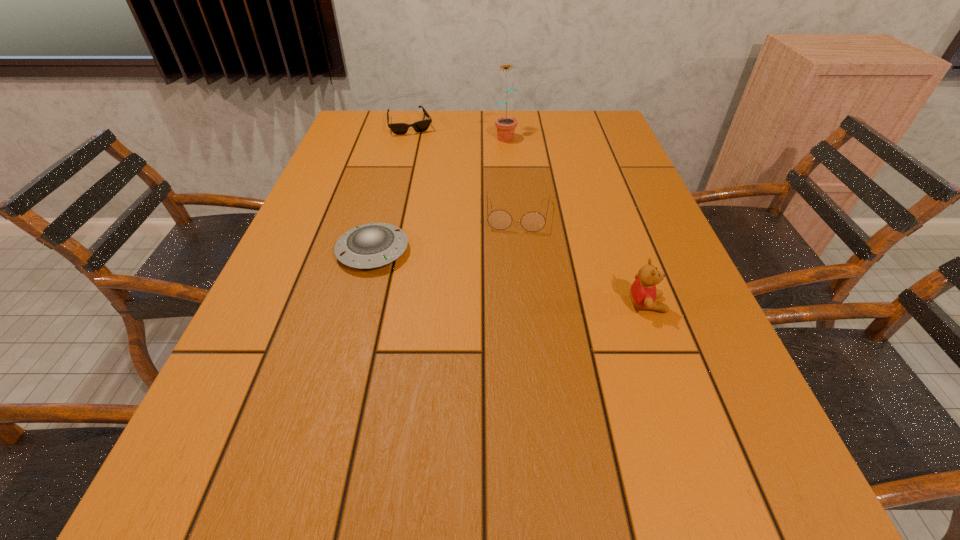
Locate an element on the screen. The height and width of the screenshot is (540, 960). sunglasses at the left edge is located at coordinates (420, 126).

Where is `object situated at the right edge`? object situated at the right edge is located at coordinates (643, 292).

Locate an element on the screen. The height and width of the screenshot is (540, 960). object present at the far left corner is located at coordinates (420, 126).

Identify the location of free space at the far edge of the desktop. (396, 141).

Locate an element on the screen. The image size is (960, 540). vacant space at the left edge of the desktop is located at coordinates (311, 387).

Image resolution: width=960 pixels, height=540 pixels. I want to click on vacant space at the right edge of the desktop, so click(619, 189).

This screenshot has height=540, width=960. In the image, there is a desktop. Identify the location of free region at the near left corner. (299, 415).

This screenshot has width=960, height=540. What are the coordinates of `vacant space at the near right corner of the desktop` in the screenshot? It's located at click(x=699, y=413).

Locate an element on the screen. The image size is (960, 540). unoccupied area between the sunglasses and the tallest object is located at coordinates (457, 130).

Where is `vacant region between the sunglasses and the sunflower`? This screenshot has height=540, width=960. vacant region between the sunglasses and the sunflower is located at coordinates (457, 130).